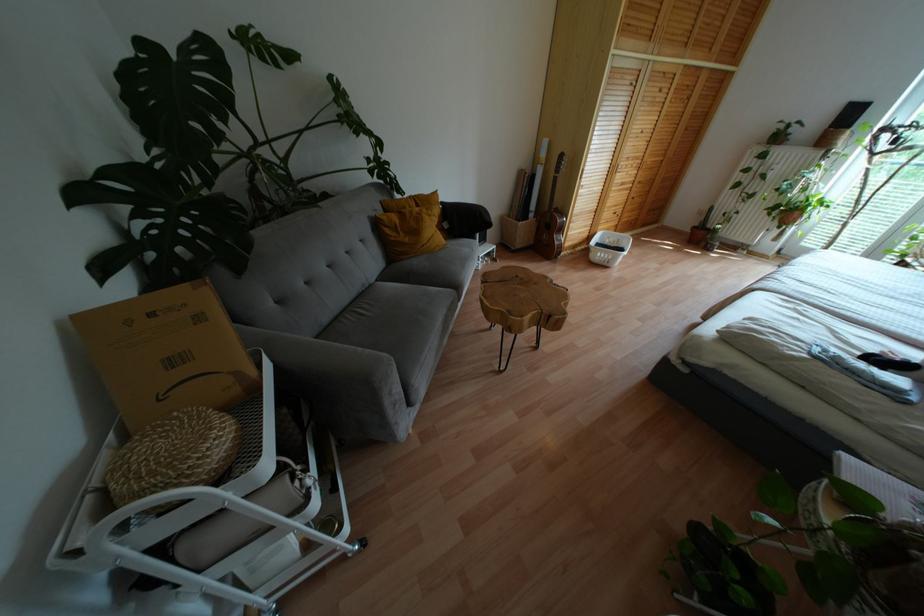
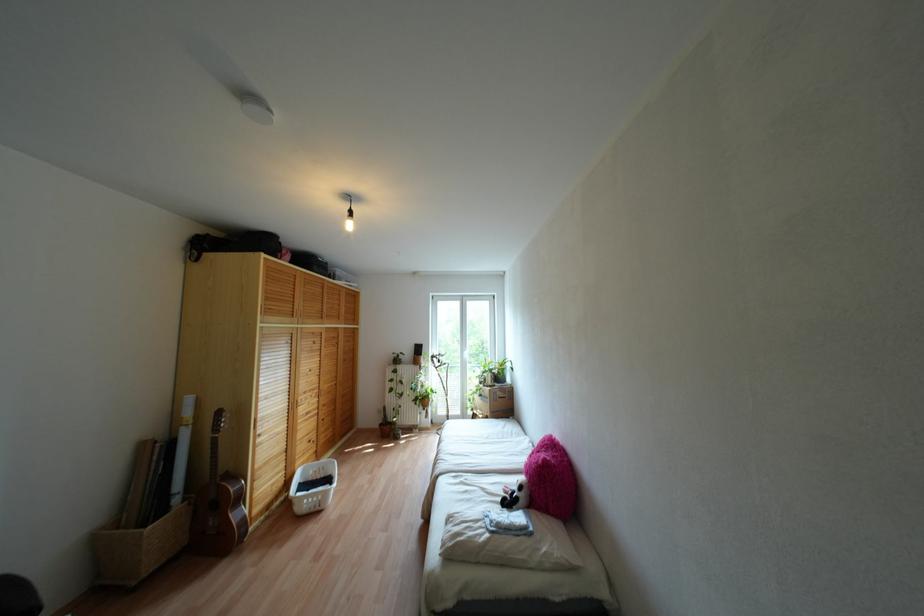
Find the pixel in the second image that matches point 604,262 in the first image.

(317, 508)